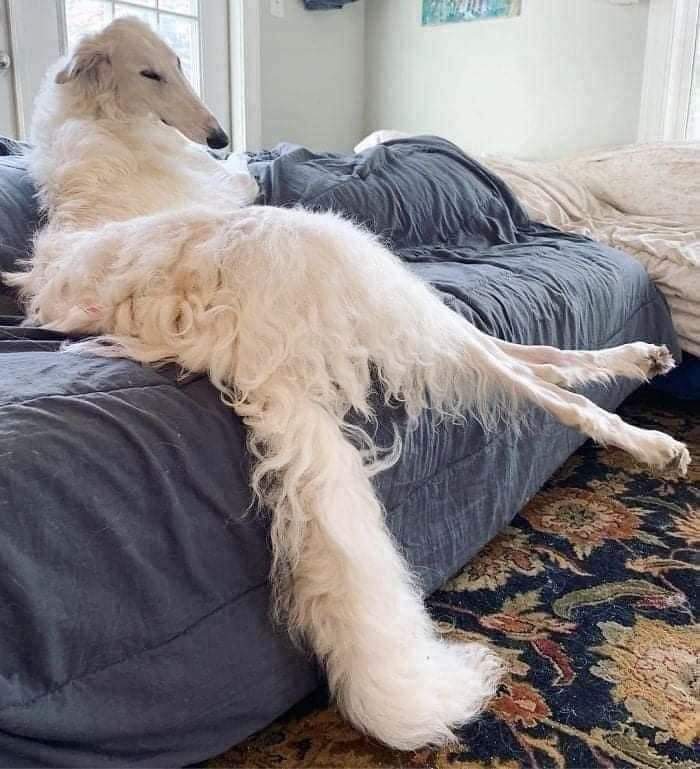
This screenshot has width=700, height=769. Find the location of `door knob`. door knob is located at coordinates (4, 57).